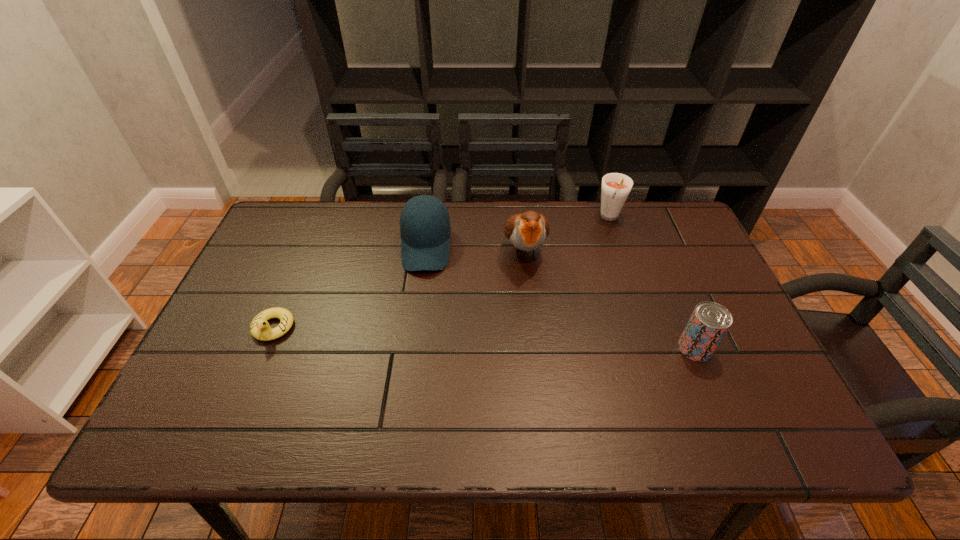
At what (x,y) coordinates should I click in order to perform the action: click on vacant space situated at the face of the third object from right to left. Please return your answer as a coordinate pair (x, y). Looking at the image, I should click on (545, 387).

Identify the location of free space located on the drink side of the root beer. (564, 303).

At what (x,y) coordinates should I click in order to perform the action: click on free region located 0.290m on the drink side of the root beer. Please return your answer as a coordinate pair (x, y). Looking at the image, I should click on (573, 287).

I want to click on vacant region located on the drink side of the root beer, so click(591, 255).

Where is `vacant space situated on the front-facing side of the second object from left to right`? The image size is (960, 540). vacant space situated on the front-facing side of the second object from left to right is located at coordinates (419, 346).

This screenshot has height=540, width=960. I want to click on vacant space located on the front-facing side of the second object from left to right, so point(420,323).

You are a GUI agent. You are given a task and a screenshot of the screen. Output one action in this format:
    pyautogui.click(x=<x>, y=<y>)
    Task: Click on the vacant position located 0.330m on the front-facing side of the second object from left to right
    The image size is (960, 540).
    Given the screenshot: What is the action you would take?
    pyautogui.click(x=417, y=378)

Identify the location of bird that is positioned at the far edge. This screenshot has width=960, height=540. (527, 231).

You are a GUI agent. You are given a task and a screenshot of the screen. Output one action in this format:
    pyautogui.click(x=<x>, y=<y>)
    Task: Click on the root beer located at the far edge
    
    Given the screenshot: What is the action you would take?
    pyautogui.click(x=616, y=187)

The width and height of the screenshot is (960, 540). I want to click on baseball cap that is at the far edge, so click(425, 229).